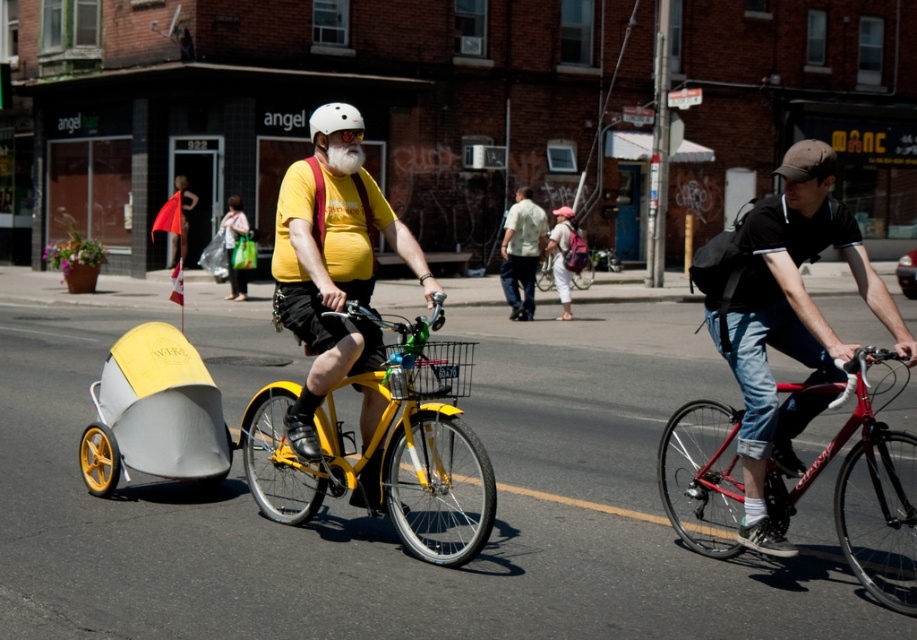
You are a delivery person who needs to place a package on the white matte bicycle helmet at upper center. The package is 10 cm in width. Can the package fit on the matte black bicycle at center?

The white matte bicycle helmet at upper center might be wider than matte black bicycle at center, so the package might fit on the white matte bicycle helmet at upper center but not necessarily on the matte black bicycle at center. Check the width of the matte black bicycle at center first.

You are taking a photo of the scene and want to focus on both the point at coordinates point [351,116] and point [547,268]. Which point should you adjust your focus to ensure both are in sharp view?

Point [351,116] is closer to the camera than point [547,268]. To ensure both are in sharp view, focus on point [351,116] since it is closer, and the depth of field will likely cover the farther point as well.